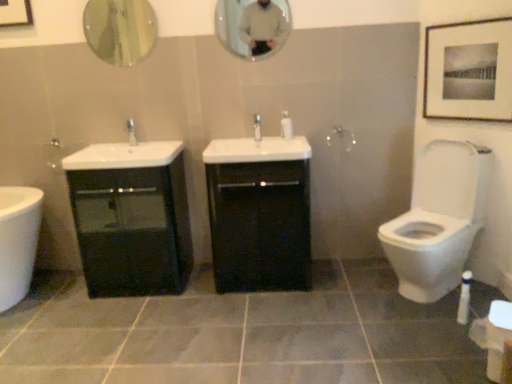
Locate an element on the screen. Image resolution: width=512 pixels, height=384 pixels. vacant area that lies between white glossy toilet at right and black glossy cabinet at left, which appears as the second bathroom cabinet when viewed from the right is located at coordinates (286, 293).